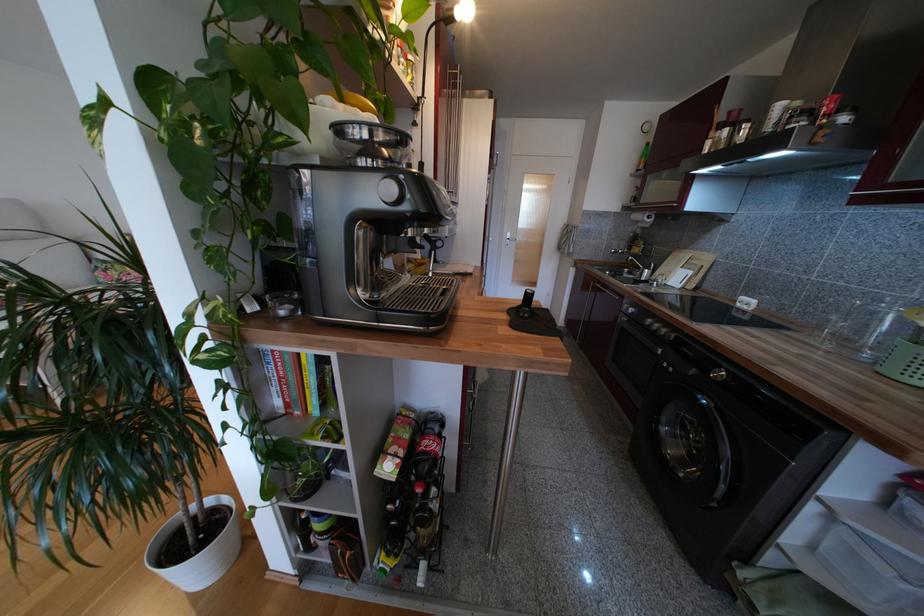
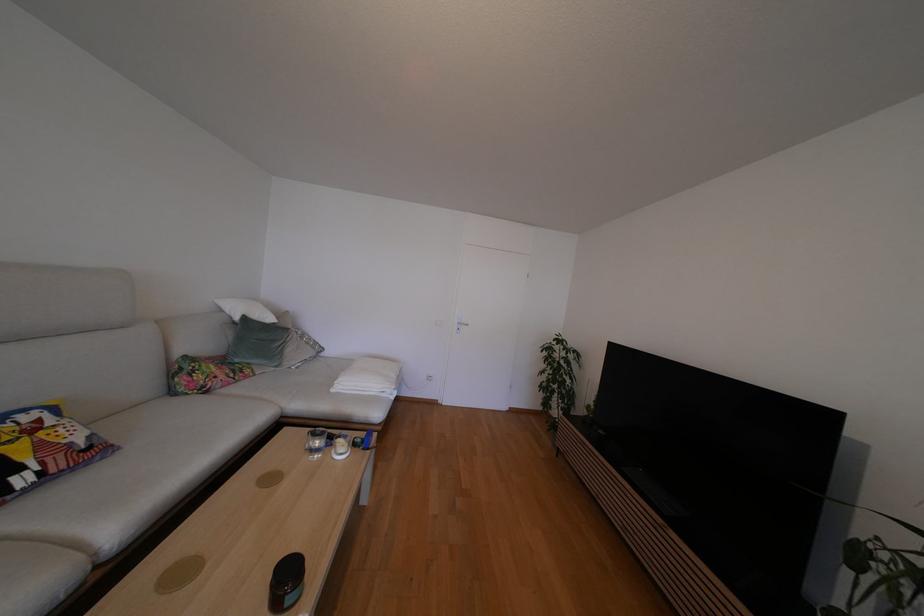
Locate, in the second image, the point that corresponds to the point at 120,268 in the first image.

(207, 368)